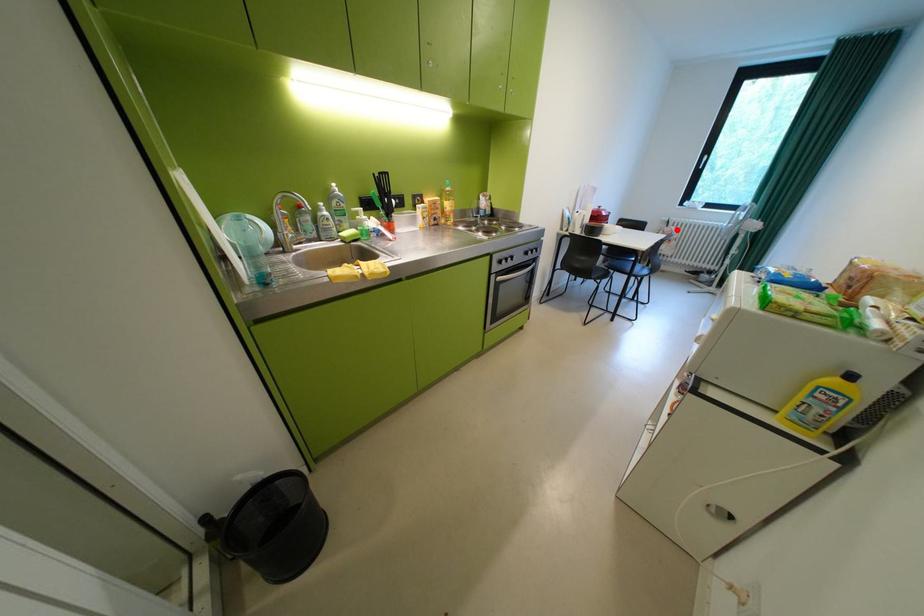
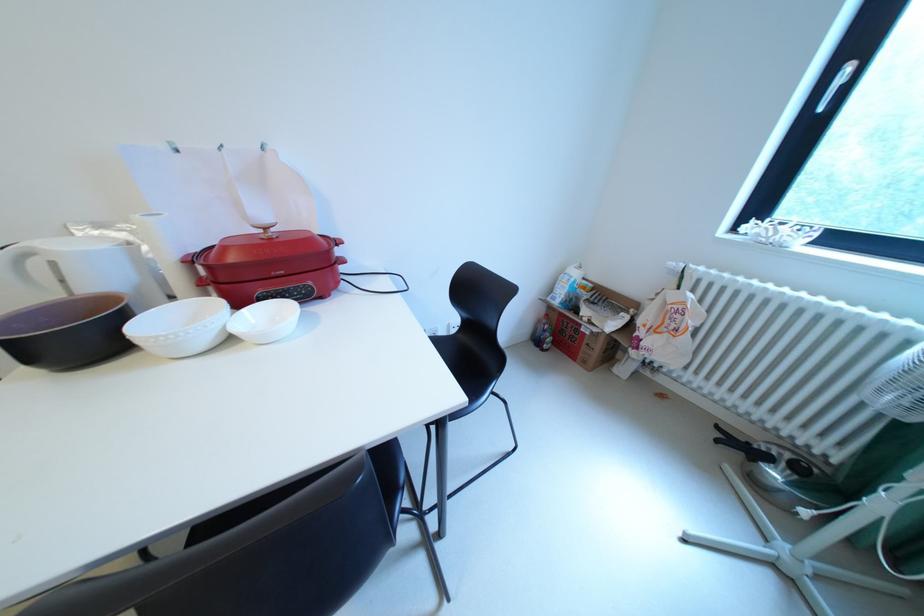
Where in the second image is the point corresponding to the highlighted location from the first image?

(682, 297)